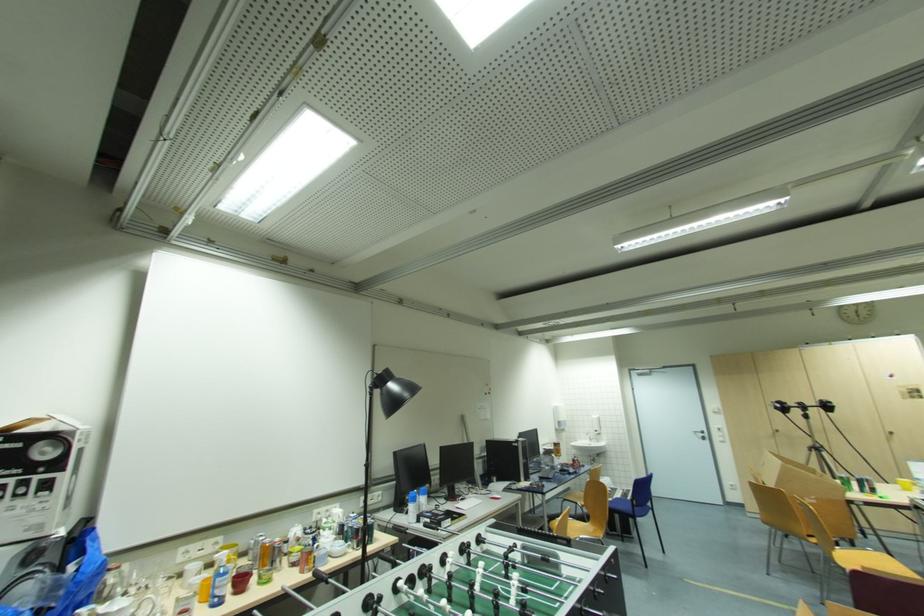
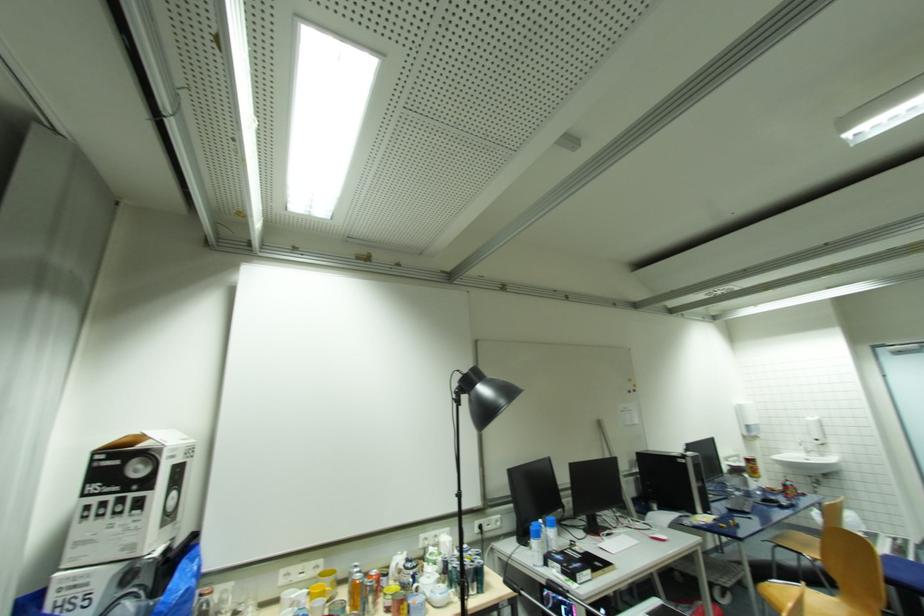
Question: The camera is either moving clockwise (left) or counter-clockwise (right) around the object. The first image is from the beginning of the video and the second image is from the end. Is the camera moving left or right when shooting the video?

Choices:
 (A) Left
 (B) Right

Answer: (B)